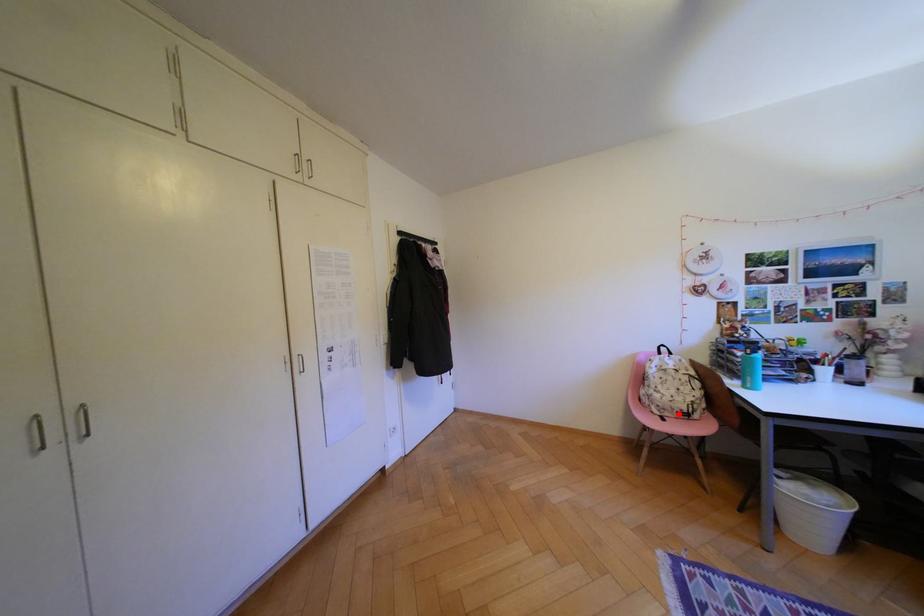
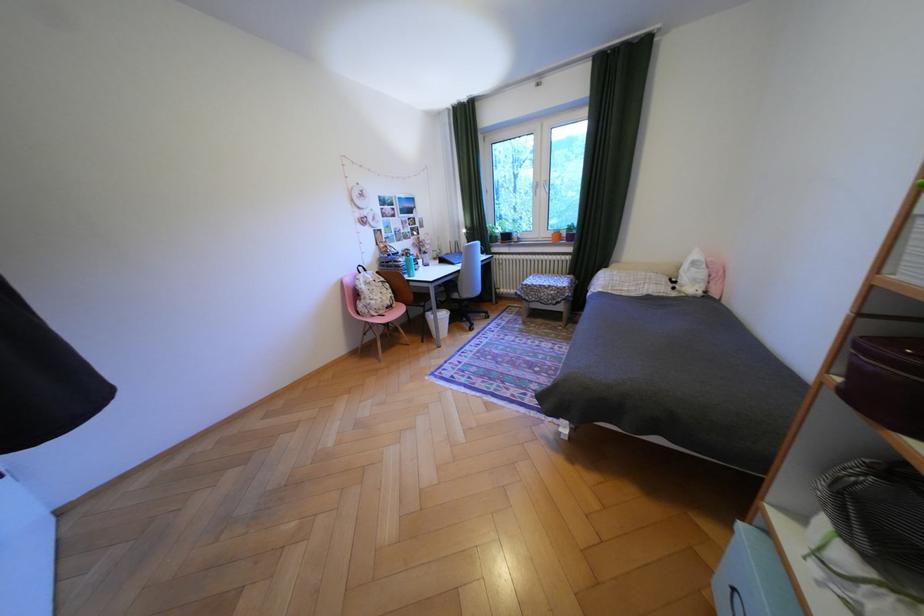
The point at the highlighted location is marked in the first image. Where is the corresponding point in the second image?

(393, 312)